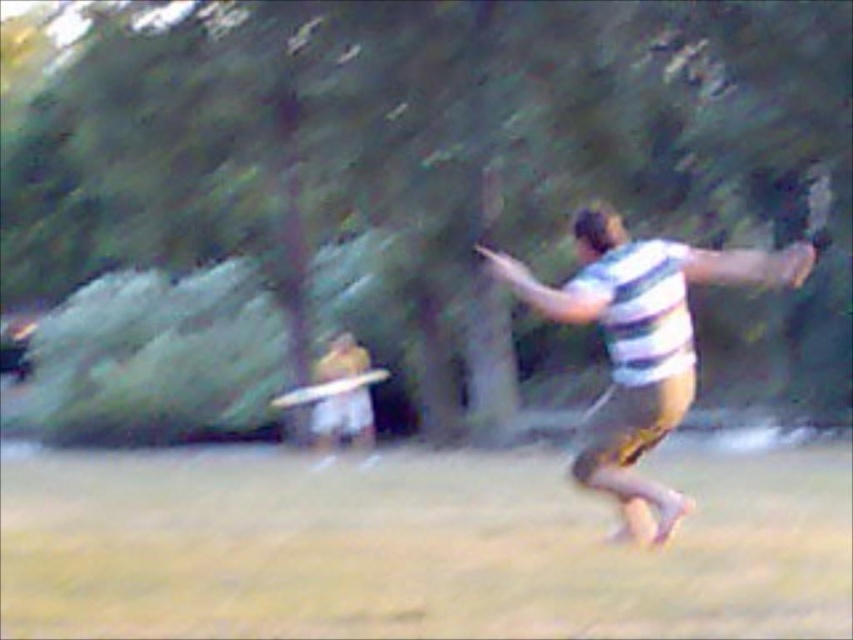
You are a photographer trying to capture the white plastic frisbee at center and the green grass at lower center in a single shot. Which object should you focus on first if you want to ensure both are in sharp focus?

You should focus on the white plastic frisbee at center first because it is above the green grass at lower center, so focusing on the closer object will help ensure both are in focus.

You are a photographer trying to capture the entire scene in one shot. Given that the green grass at lower center and the white plastic frisbee at center are both in the frame, which object will occupy more of the image horizontally?

The green grass at lower center will occupy more of the image horizontally since its width is larger than that of the white plastic frisbee at center.